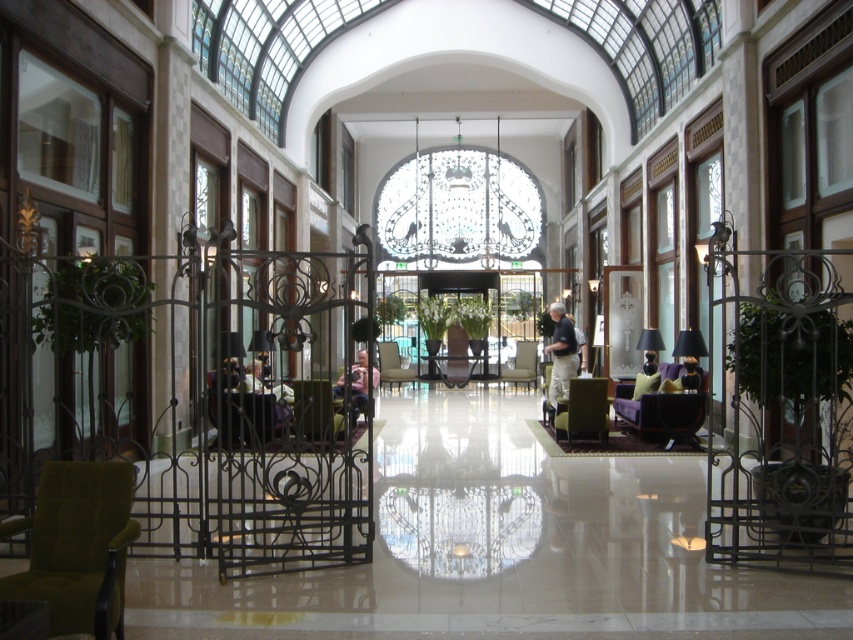
You are a guest in this atrium and want to sit down comfortably. Which object would be more suitable for sitting, the velvet dark brown armchair at center or the matte black lamp at right?

The velvet dark brown armchair at center is much taller than the matte black lamp at right, so it is more suitable for sitting.

You are a guest in the atrium and want to sit down. You see a velvet dark brown armchair at center and a matte gray armchair at center. Which armchair is positioned to the right side when facing the gate?

The velvet dark brown armchair at center is to the right of the matte gray armchair at center, so it is positioned to the right side when facing the gate.